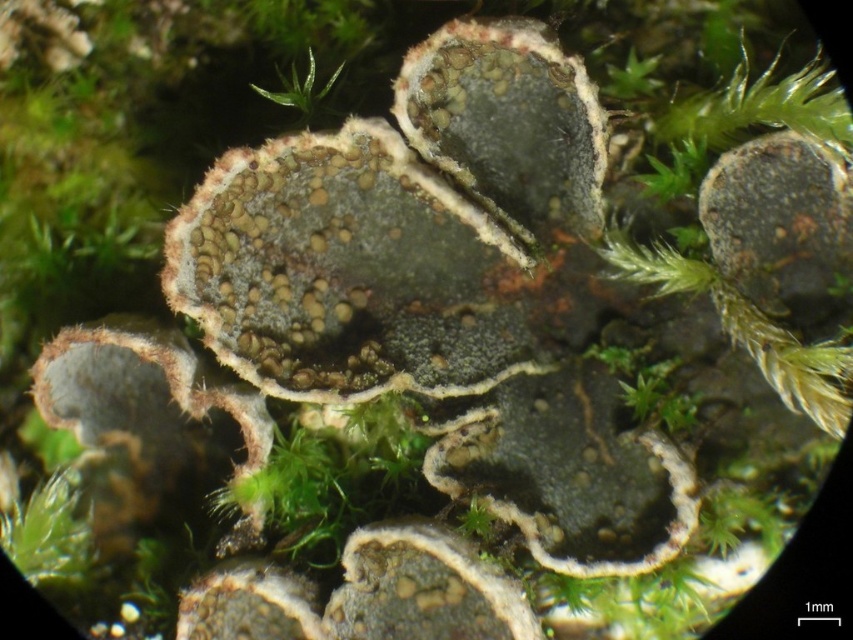
This screenshot has width=853, height=640. What do you see at coordinates (422, 588) in the screenshot?
I see `speckled gray rock at center` at bounding box center [422, 588].

In the scene shown: Is speckled gray rock at center smaller than green fuzzy moss at upper center?

Yes, speckled gray rock at center is smaller than green fuzzy moss at upper center.

This screenshot has height=640, width=853. Identify the location of speckled gray rock at center. (422, 588).

At what (x,y) coordinates should I click in order to perform the action: click on speckled gray rock at center. Please return your answer as a coordinate pair (x, y). This screenshot has width=853, height=640. Looking at the image, I should click on (422, 588).

Who is lower down, dark gray textured lichen at center or green fuzzy moss at upper center?

Positioned lower is dark gray textured lichen at center.

Does point (488, 397) come behind point (291, 81)?

No.

Which is in front, point (485, 435) or point (251, 84)?

Positioned in front is point (485, 435).

The width and height of the screenshot is (853, 640). In order to click on dark gray textured lichen at center in this screenshot , I will do `click(570, 472)`.

Which is above, matte gray lichen at upper right or green fuzzy moss at upper center?

green fuzzy moss at upper center is higher up.

Is point (751, 298) more distant than point (334, 80)?

No, (751, 298) is in front of (334, 80).

Is point (791, 172) closer to camera compared to point (339, 72)?

Yes, point (791, 172) is in front of point (339, 72).

Where is `matte gray lichen at upper right`? matte gray lichen at upper right is located at coordinates (779, 220).